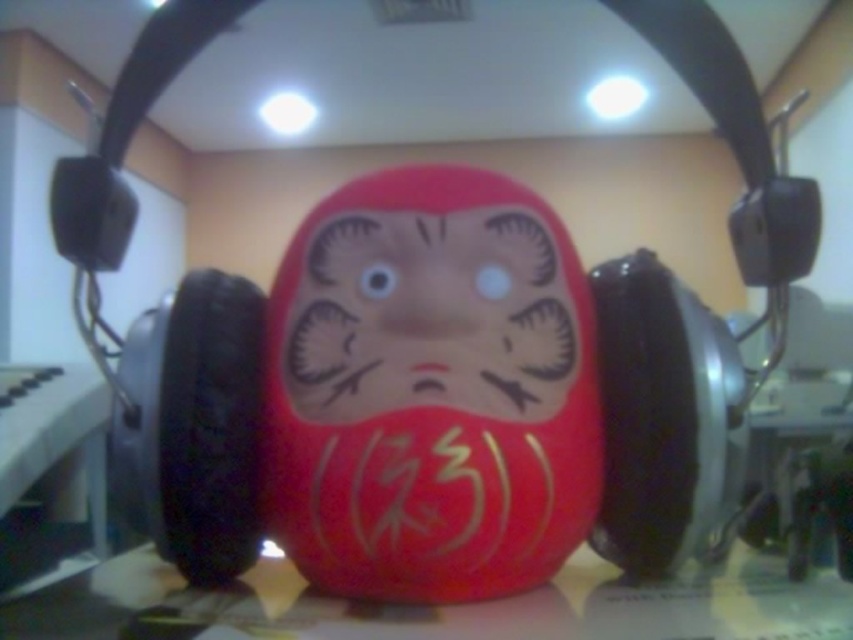
Who is higher up, matte red daruma doll at center or matte plastic table at center?

Positioned higher is matte red daruma doll at center.

In the scene shown: Is matte red daruma doll at center to the right of matte plastic table at center from the viewer's perspective?

Incorrect, matte red daruma doll at center is not on the right side of matte plastic table at center.

In order to click on matte red daruma doll at center in this screenshot , I will do `click(430, 316)`.

Where is `matte red daruma doll at center`? The height and width of the screenshot is (640, 853). matte red daruma doll at center is located at coordinates (430, 316).